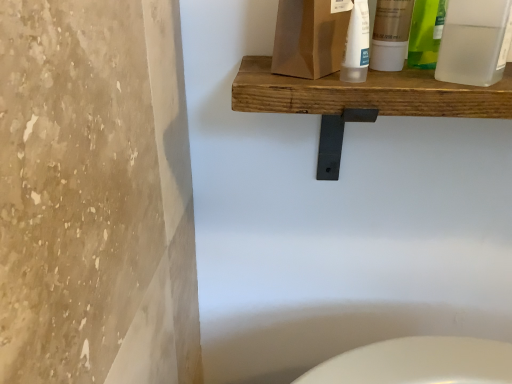
Question: In which direction should I rotate to look at matte white tube at upper center, marked as the second mouthwash in a right-to-left arrangement?

Choices:
 (A) left
 (B) right

Answer: (B)

Question: Can you confirm if matte white tube at upper center, acting as the 1th mouthwash starting from the left, is smaller than translucent plastic tube at upper center, the second cleaning product when ordered from left to right?

Choices:
 (A) yes
 (B) no

Answer: (B)

Question: Considering the relative sizes of matte white tube at upper center, acting as the 1th mouthwash starting from the left, and translucent plastic tube at upper center, the second cleaning product when ordered from left to right, in the image provided, is matte white tube at upper center, acting as the 1th mouthwash starting from the left, thinner than translucent plastic tube at upper center, the second cleaning product when ordered from left to right,?

Choices:
 (A) no
 (B) yes

Answer: (A)

Question: Considering the relative sizes of matte white tube at upper center, acting as the 1th mouthwash starting from the left, and translucent plastic tube at upper center, marked as the first cleaning product in a right-to-left arrangement, in the image provided, is matte white tube at upper center, acting as the 1th mouthwash starting from the left, wider than translucent plastic tube at upper center, marked as the first cleaning product in a right-to-left arrangement,?

Choices:
 (A) no
 (B) yes

Answer: (B)

Question: Can you confirm if matte white tube at upper center, acting as the 1th mouthwash starting from the left, is taller than translucent plastic tube at upper center, marked as the first cleaning product in a right-to-left arrangement?

Choices:
 (A) yes
 (B) no

Answer: (A)

Question: From the image's perspective, is matte white tube at upper center, marked as the second mouthwash in a right-to-left arrangement, on translucent plastic tube at upper center, marked as the first cleaning product in a right-to-left arrangement?

Choices:
 (A) no
 (B) yes

Answer: (B)

Question: Is matte white tube at upper center, acting as the 1th mouthwash starting from the left, to the right of translucent plastic tube at upper center, the second cleaning product when ordered from left to right, from the viewer's perspective?

Choices:
 (A) no
 (B) yes

Answer: (B)

Question: Does wooden shelf at upper center have a larger size compared to matte white tube at upper center, marked as the second mouthwash in a right-to-left arrangement?

Choices:
 (A) yes
 (B) no

Answer: (A)

Question: Are wooden shelf at upper center and matte white tube at upper center, marked as the second mouthwash in a right-to-left arrangement, located far from each other?

Choices:
 (A) yes
 (B) no

Answer: (B)

Question: Could you tell me if wooden shelf at upper center is turned towards matte white tube at upper center, acting as the 1th mouthwash starting from the left?

Choices:
 (A) no
 (B) yes

Answer: (A)

Question: Is wooden shelf at upper center with matte white tube at upper center, acting as the 1th mouthwash starting from the left?

Choices:
 (A) yes
 (B) no

Answer: (B)

Question: From the image's perspective, is wooden shelf at upper center over matte white tube at upper center, acting as the 1th mouthwash starting from the left?

Choices:
 (A) yes
 (B) no

Answer: (B)

Question: From the image's perspective, is wooden shelf at upper center located beneath matte white tube at upper center, marked as the second mouthwash in a right-to-left arrangement?

Choices:
 (A) yes
 (B) no

Answer: (A)

Question: Considering the relative sizes of wooden shelf at upper center and translucent plastic tube at upper center, the second cleaning product when ordered from left to right, in the image provided, is wooden shelf at upper center smaller than translucent plastic tube at upper center, the second cleaning product when ordered from left to right,?

Choices:
 (A) no
 (B) yes

Answer: (A)